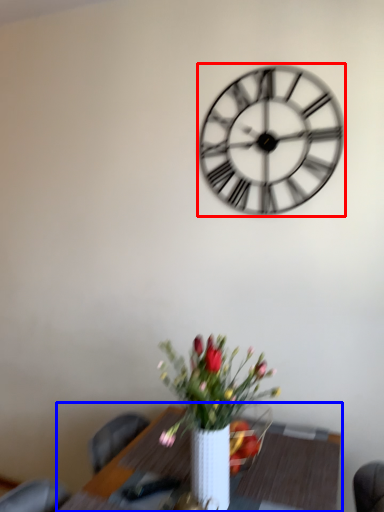
Question: Which object is further to the camera taking this photo, wall clock (highlighted by a red box) or table (highlighted by a blue box)?

Choices:
 (A) wall clock
 (B) table

Answer: (A)